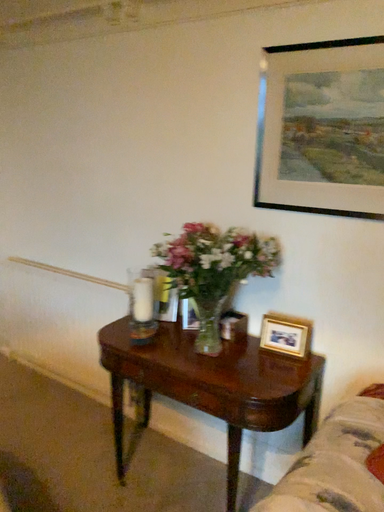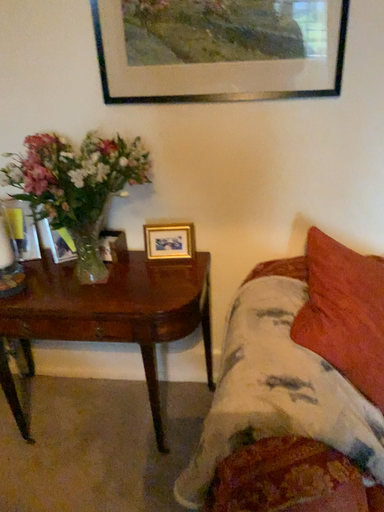
Question: How did the camera likely rotate when shooting the video?

Choices:
 (A) rotated upward
 (B) rotated downward

Answer: (B)